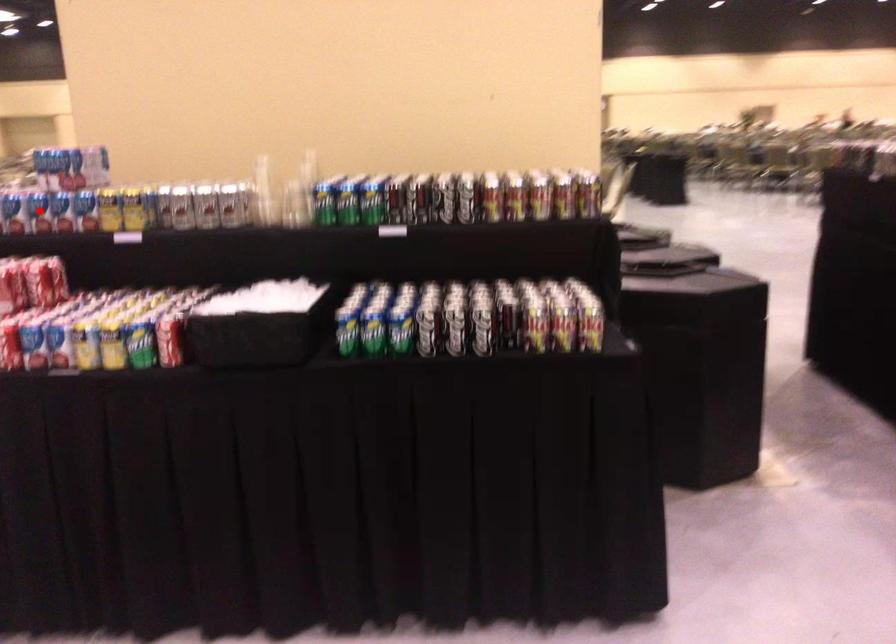
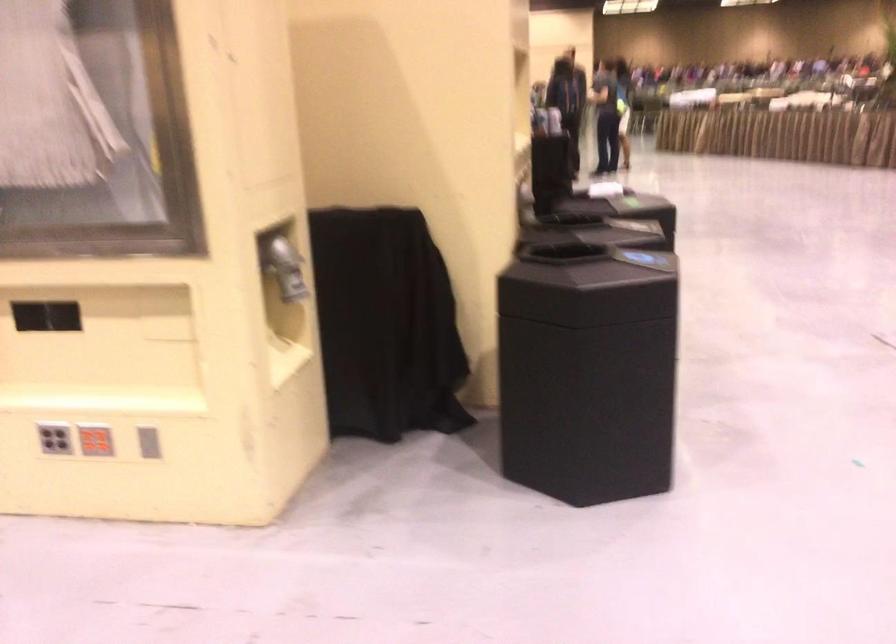
Question: I am providing you with two images of the same scene from different viewpoints. A red point is marked on the first image. Is the red point's position out of view in image 2?

Choices:
 (A) Yes
 (B) No

Answer: (A)